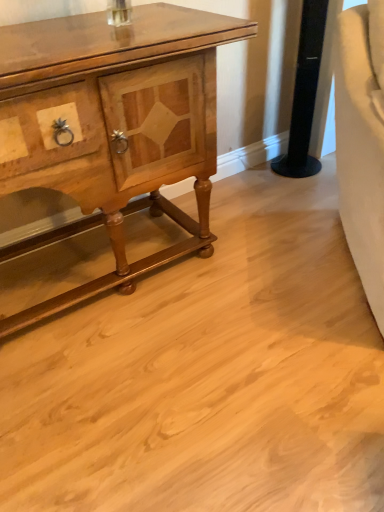
Question: From the image's perspective, would you say wooden polished cabinet at left is shown under black glossy speaker at upper right?

Choices:
 (A) yes
 (B) no

Answer: (A)

Question: Are wooden polished cabinet at left and black glossy speaker at upper right beside each other?

Choices:
 (A) yes
 (B) no

Answer: (B)

Question: Is wooden polished cabinet at left positioned with its back to black glossy speaker at upper right?

Choices:
 (A) yes
 (B) no

Answer: (B)

Question: From a real-world perspective, is wooden polished cabinet at left beneath black glossy speaker at upper right?

Choices:
 (A) yes
 (B) no

Answer: (B)

Question: Does wooden polished cabinet at left have a greater width compared to black glossy speaker at upper right?

Choices:
 (A) no
 (B) yes

Answer: (B)

Question: Is wooden polished cabinet at left taller than black glossy speaker at upper right?

Choices:
 (A) no
 (B) yes

Answer: (B)

Question: Does black glossy speaker at upper right come behind wooden polished cabinet at left?

Choices:
 (A) no
 (B) yes

Answer: (B)

Question: Does black glossy speaker at upper right appear on the right side of wooden polished cabinet at left?

Choices:
 (A) yes
 (B) no

Answer: (A)

Question: Can you confirm if black glossy speaker at upper right is wider than wooden polished cabinet at left?

Choices:
 (A) yes
 (B) no

Answer: (B)

Question: Considering the relative sizes of black glossy speaker at upper right and wooden polished cabinet at left in the image provided, is black glossy speaker at upper right bigger than wooden polished cabinet at left?

Choices:
 (A) yes
 (B) no

Answer: (B)

Question: Considering the relative sizes of black glossy speaker at upper right and wooden polished cabinet at left in the image provided, is black glossy speaker at upper right shorter than wooden polished cabinet at left?

Choices:
 (A) yes
 (B) no

Answer: (A)

Question: From a real-world perspective, is black glossy speaker at upper right on top of wooden polished cabinet at left?

Choices:
 (A) yes
 (B) no

Answer: (B)

Question: Visually, is black glossy speaker at upper right positioned to the left or to the right of wooden polished cabinet at left?

Choices:
 (A) right
 (B) left

Answer: (A)